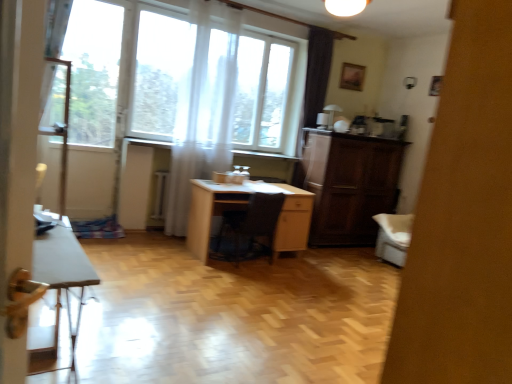
Question: Is light wood desk at center at the left side of transparent fabric at left?

Choices:
 (A) yes
 (B) no

Answer: (B)

Question: From a real-world perspective, is light wood desk at center over transparent fabric at left?

Choices:
 (A) no
 (B) yes

Answer: (A)

Question: Is light wood desk at center located outside transparent fabric at left?

Choices:
 (A) no
 (B) yes

Answer: (B)

Question: Does light wood desk at center lie in front of transparent fabric at left?

Choices:
 (A) yes
 (B) no

Answer: (A)

Question: From a real-world perspective, is light wood desk at center under transparent fabric at left?

Choices:
 (A) no
 (B) yes

Answer: (B)

Question: Does light wood desk at center have a greater height compared to transparent fabric at left?

Choices:
 (A) yes
 (B) no

Answer: (B)

Question: Is white glossy table at lower left not within transparent fabric at left?

Choices:
 (A) no
 (B) yes

Answer: (B)

Question: From the image's perspective, is white glossy table at lower left under transparent fabric at left?

Choices:
 (A) no
 (B) yes

Answer: (B)

Question: Is white glossy table at lower left positioned before transparent fabric at left?

Choices:
 (A) no
 (B) yes

Answer: (B)

Question: Could you tell me if white glossy table at lower left is turned towards transparent fabric at left?

Choices:
 (A) no
 (B) yes

Answer: (A)

Question: Is white glossy table at lower left to the left of transparent fabric at left from the viewer's perspective?

Choices:
 (A) no
 (B) yes

Answer: (A)

Question: Is white glossy table at lower left further to camera compared to transparent fabric at left?

Choices:
 (A) no
 (B) yes

Answer: (A)

Question: Does white glossy table at lower left have a smaller size compared to white sheer curtain at upper center?

Choices:
 (A) no
 (B) yes

Answer: (B)